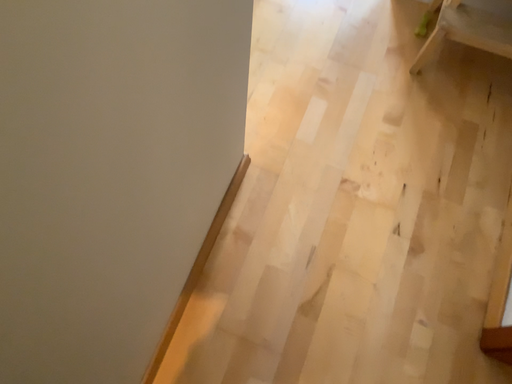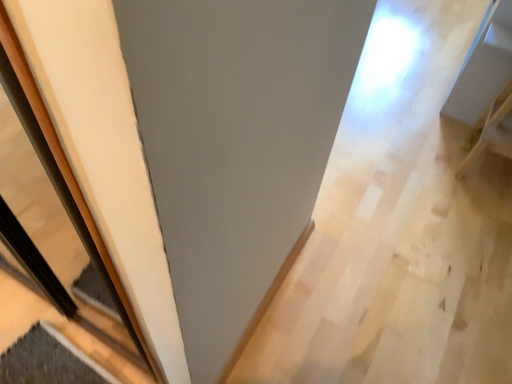
Question: How did the camera likely rotate when shooting the video?

Choices:
 (A) rotated upward
 (B) rotated downward

Answer: (A)